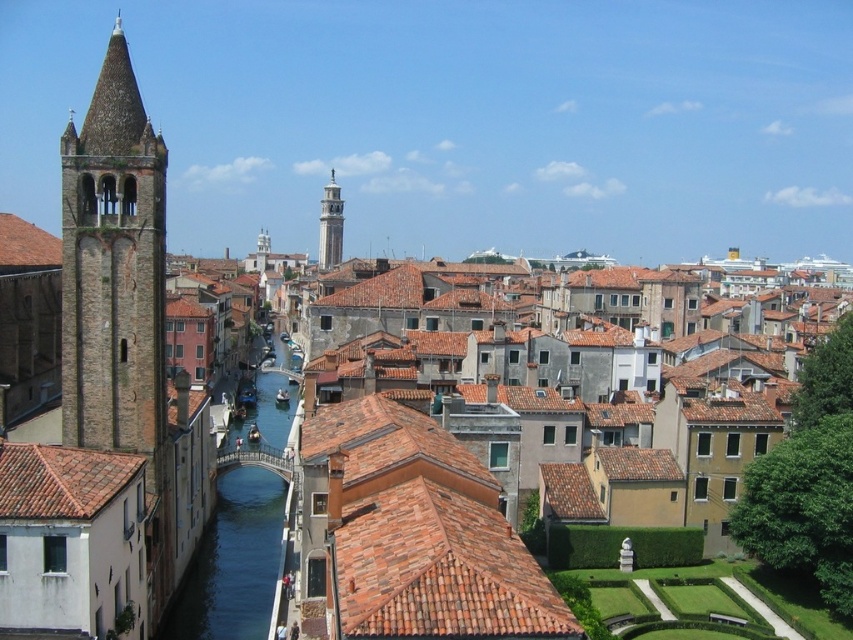
Is brown tile roof at center thinner than brown tile roof at left?

Yes, brown tile roof at center is thinner than brown tile roof at left.

Is point (651, 460) positioned behind point (26, 246)?

No.

Does point (595, 470) come in front of point (9, 227)?

Yes, it is in front of point (9, 227).

Find the location of a particular element. brown tile roof at center is located at coordinates (633, 465).

Between point (125, 296) and point (244, 602), which one is positioned in front?

Point (125, 296)

Is point (140, 195) positioned before point (213, 561)?

Yes, it is.

Who is more distant from viewer, (142,115) or (167,612)?

Point (167,612)

You are a GUI agent. You are given a task and a screenshot of the screen. Output one action in this format:
    pyautogui.click(x=<x>, y=<y>)
    Task: Click on the brown stone tower at left
    
    Given the screenshot: What is the action you would take?
    pyautogui.click(x=114, y=272)

Between brown stone tower at left and brown tile roof at center, which one has more height?

Standing taller between the two is brown stone tower at left.

Between brown stone tower at left and brown tile roof at center, which one is positioned higher?

Positioned higher is brown stone tower at left.

Which is in front, point (105, 372) or point (668, 460)?

Positioned in front is point (105, 372).

This screenshot has width=853, height=640. Find the location of `brown stone tower at left`. brown stone tower at left is located at coordinates (114, 272).